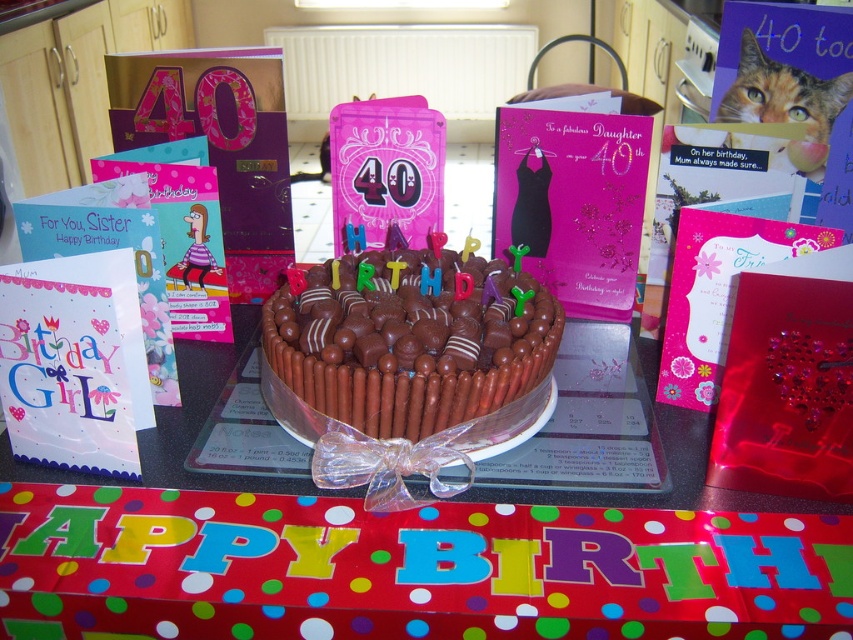
Is point (602, 305) farther from camera compared to point (693, 282)?

That is True.

Consider the image. Who is positioned more to the left, pink glittery dress at center or pink glittery card at center?

From the viewer's perspective, pink glittery dress at center appears more on the left side.

What do you see at coordinates (573, 202) in the screenshot?
I see `pink glittery dress at center` at bounding box center [573, 202].

Image resolution: width=853 pixels, height=640 pixels. What are the coordinates of `pink glittery dress at center` in the screenshot? It's located at (573, 202).

Who is shorter, chocolatesmoothcake at center or white paper card at left?

chocolatesmoothcake at center

Measure the distance between point (361, 260) and camera.

Point (361, 260) is 29.53 inches from camera.

Locate an element on the screen. The image size is (853, 640). chocolatesmoothcake at center is located at coordinates (408, 352).

Is chocolate cake at center to the left of orange fur cat at upper right from the viewer's perspective?

Indeed, chocolate cake at center is positioned on the left side of orange fur cat at upper right.

Does chocolate cake at center appear on the right side of orange fur cat at upper right?

Incorrect, chocolate cake at center is not on the right side of orange fur cat at upper right.

Is point (802, 598) positioned before point (753, 93)?

Yes, it is.

Identify the location of chocolate cake at center. (405, 550).